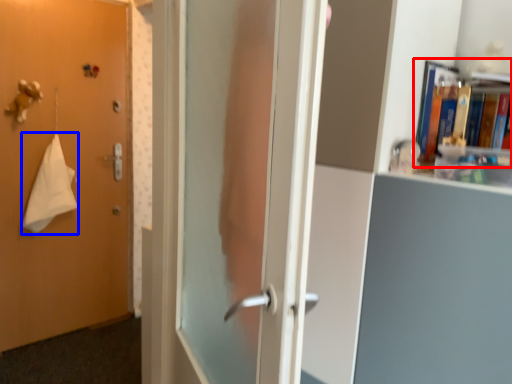
Question: Among these objects, which one is nearest to the camera, book (highlighted by a red box) or bath towel (highlighted by a blue box)?

Choices:
 (A) book
 (B) bath towel

Answer: (A)